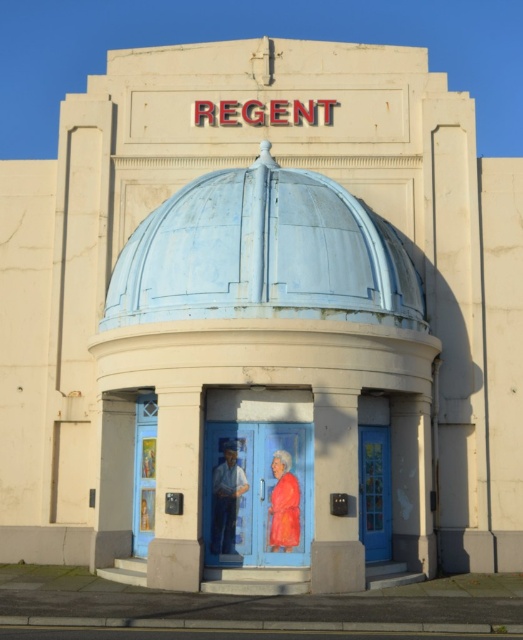
Is matte blue statue at center positioned before orange velvet robe at center?

No.

Is matte blue statue at center bigger than orange velvet robe at center?

Indeed, matte blue statue at center has a larger size compared to orange velvet robe at center.

What do you see at coordinates (226, 499) in the screenshot?
I see `matte blue statue at center` at bounding box center [226, 499].

At what (x,y) coordinates should I click in order to perform the action: click on matte blue statue at center. Please return your answer as a coordinate pair (x, y). This screenshot has width=523, height=640. Looking at the image, I should click on (226, 499).

Is point (226, 300) positioned before point (214, 480)?

Yes, point (226, 300) is in front of point (214, 480).

I want to click on light blue metallic dome at center, so 264,253.

Can you confirm if light blue metallic dome at center is positioned to the right of blue painted door at center?

In fact, light blue metallic dome at center is to the left of blue painted door at center.

Between light blue metallic dome at center and blue painted door at center, which one is positioned lower?

blue painted door at center is lower down.

The image size is (523, 640). I want to click on light blue metallic dome at center, so click(264, 253).

Where is `light blue metallic dome at center`? The image size is (523, 640). light blue metallic dome at center is located at coordinates (264, 253).